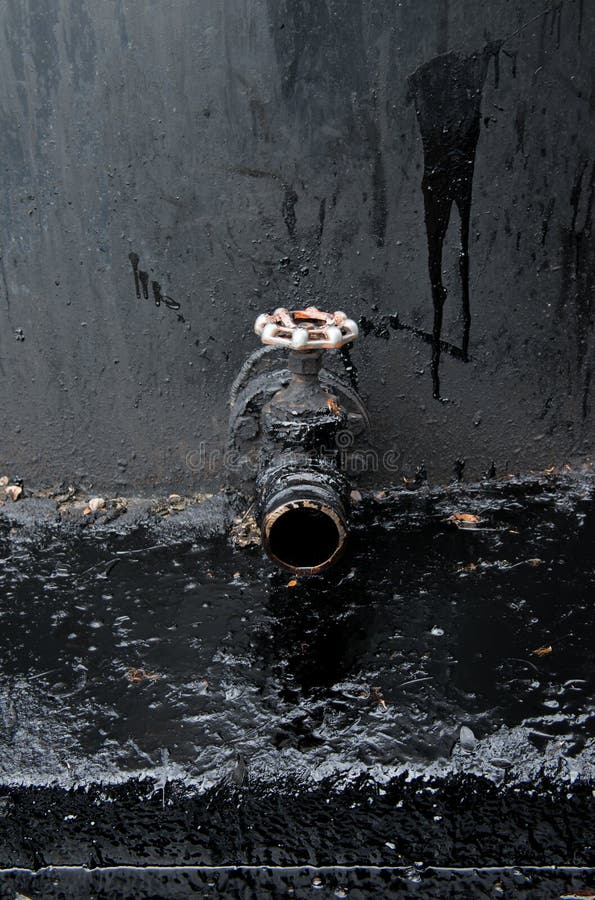
This screenshot has width=595, height=900. In order to click on spigot handle in this screenshot , I will do `click(303, 335)`.